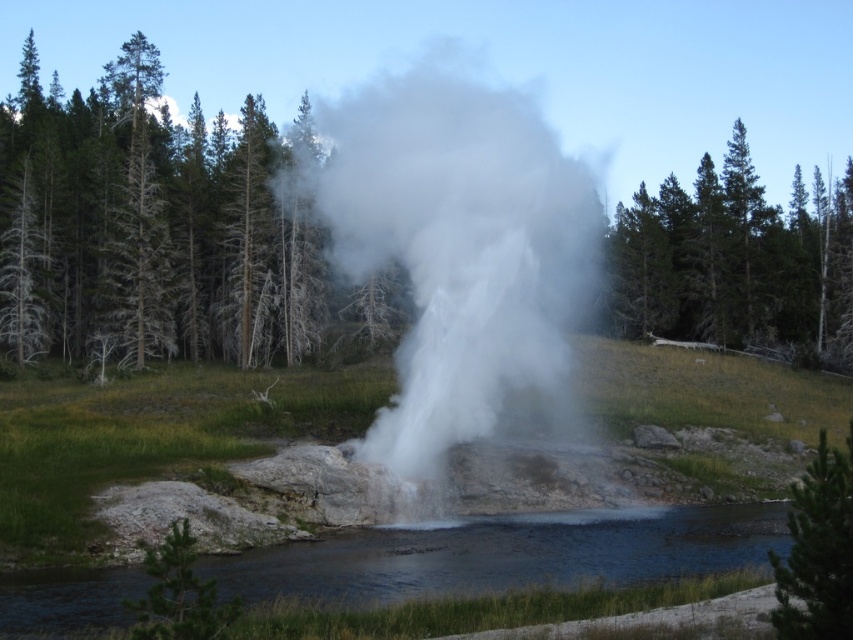
You are a photographer aiming to capture the geyser and its surroundings. You have a camera with a standard lens that can focus on objects up to 3 meters tall. Based on the scene, will the white vapor at center and the clear water at lower center both be in focus?

The white vapor at center is taller than the clear water at lower center. Since the vapor exceeds the 3 meter focus limit, it may not be fully in focus, while the water might be within range.

You are a photographer trying to capture the geyser in the scene. You have a camera with a standard lens that can focus on objects up to 5 meters away. The white vapor at center and the clear water at lower center are both in your view. Which object will appear bigger in your photo?

The white vapor at center will appear bigger in the photo because it has a larger size compared to the clear water at lower center.

You are standing at point [28,596] and want to walk to the geyser in the center. Is there a clear path to the geyser without passing through point [428,202]?

Point [428,202] is behind point [28,596], so you can walk towards the geyser in the center without passing through point [428,202] because it is located behind your current position.